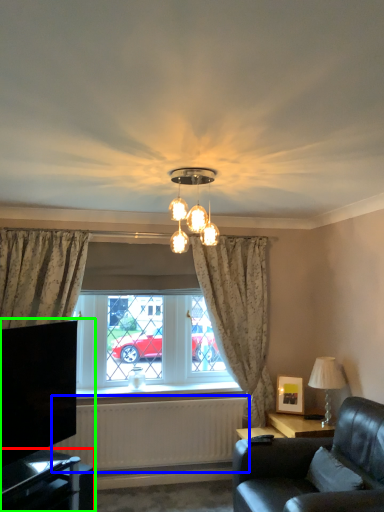
Question: Which is nearer to the table (highlighted by a red box)? radiator (highlighted by a blue box) or entertainment center (highlighted by a green box).

Choices:
 (A) radiator
 (B) entertainment center

Answer: (B)